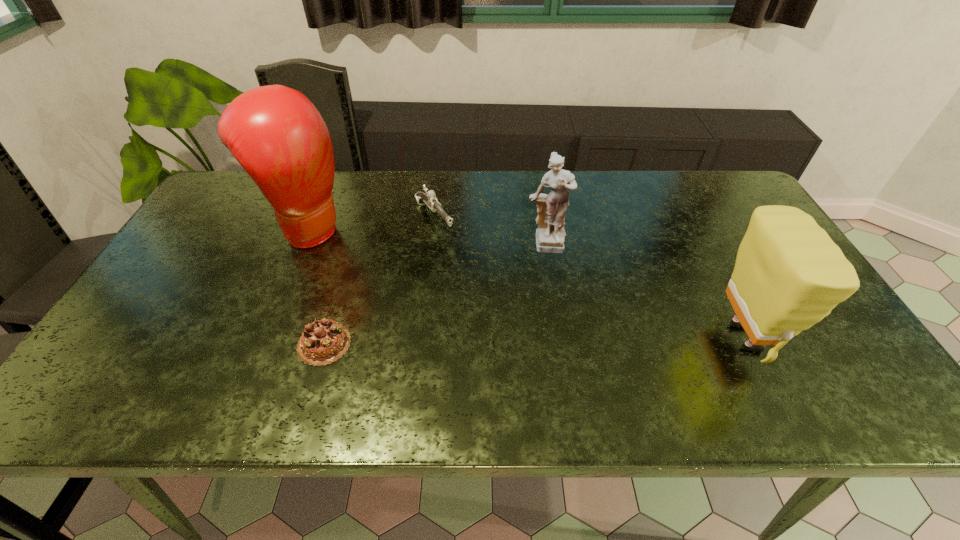
Where is `free spot on the desktop that is between the shortest object and the sponge and is positioned on the front-facing side of the second object from right to left`? The width and height of the screenshot is (960, 540). free spot on the desktop that is between the shortest object and the sponge and is positioned on the front-facing side of the second object from right to left is located at coordinates (561, 340).

I want to click on vacant space on the desktop that is between the chocolate cake and the rightmost object and is positioned aimed along the barrel of the second shortest object, so click(536, 341).

The image size is (960, 540). I want to click on vacant space on the desktop that is between the shortest object and the rightmost object and is positioned on the striking surface of the tallest object, so click(515, 341).